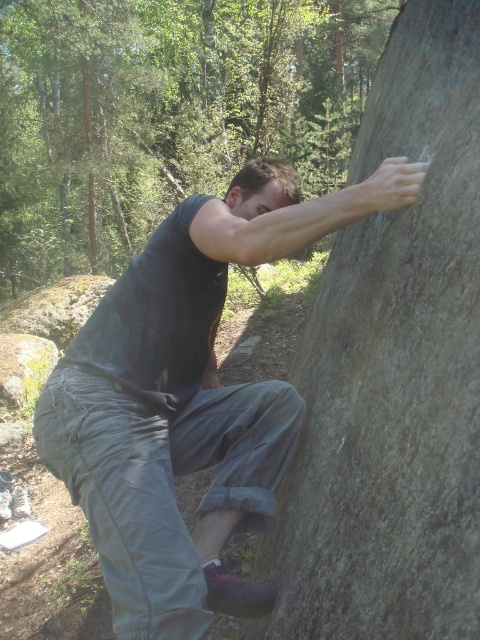
You are standing at the point where the climber is currently holding onto the rock face. You want to reach a small ledge located at point (367, 230). Given that your arm can extend 1.5 meters, can you reach the ledge from your current position?

The distance between you and the point (367, 230) is 2.30 meters. Since your arm can only extend 1.5 meters, you cannot reach the ledge from your current position.

You are a photographer trying to capture the climber in the scene. You need to decide which object, the smooth gray rock at center or the dark gray fabric pants at center, would be easier to focus on due to their size. Which one would you choose and why?

The smooth gray rock at center has a lesser width compared to dark gray fabric pants at center, so the dark gray fabric pants at center is wider and thus easier to focus on due to its larger size.

You are a safety inspector checking the climbing gear setup. The recommended minimum distance between the climber and the rock face to allow safe movement is 40 centimeters. Based on the image, is the current distance between the smooth gray rock at center and the dark gray fabric pants at center within the safety guidelines?

The distance between the smooth gray rock at center and the dark gray fabric pants at center is 39.67 centimeters, which is below the recommended 40 centimeters. Therefore, the current setup does not meet the safety guidelines.